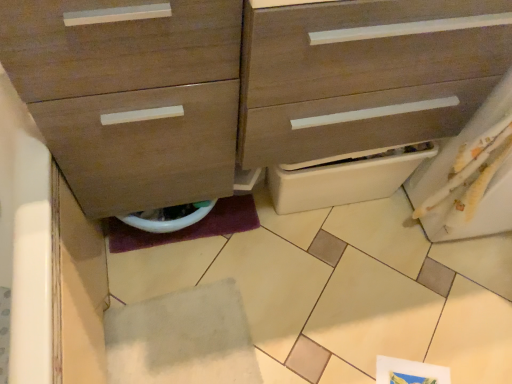
Question: Is point (68, 137) positioned closer to the camera than point (236, 314)?

Choices:
 (A) closer
 (B) farther

Answer: (A)

Question: Is matte wood chest of drawers at center spatially inside white felt tile at lower center, or outside of it?

Choices:
 (A) outside
 (B) inside

Answer: (A)

Question: Considering the real-world distances, which object is closest to the white felt tile at lower center?

Choices:
 (A) matte wood chest of drawers at center
 (B) white glossy toilet bowl at lower center

Answer: (B)

Question: Considering the real-world distances, which object is farthest from the matte wood chest of drawers at center?

Choices:
 (A) white felt tile at lower center
 (B) white glossy toilet bowl at lower center

Answer: (A)